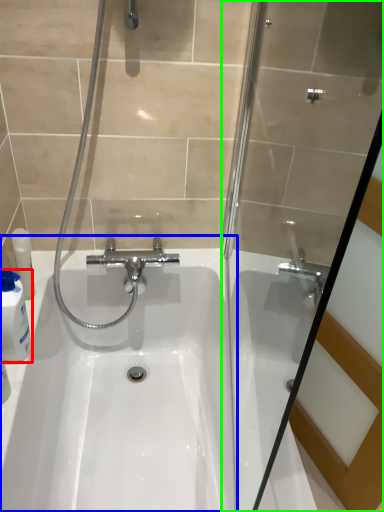
Question: Estimate the real-world distances between objects in this image. Which object is closer to cleaning product (highlighted by a red box), sink (highlighted by a blue box) or shower door (highlighted by a green box)?

Choices:
 (A) sink
 (B) shower door

Answer: (A)